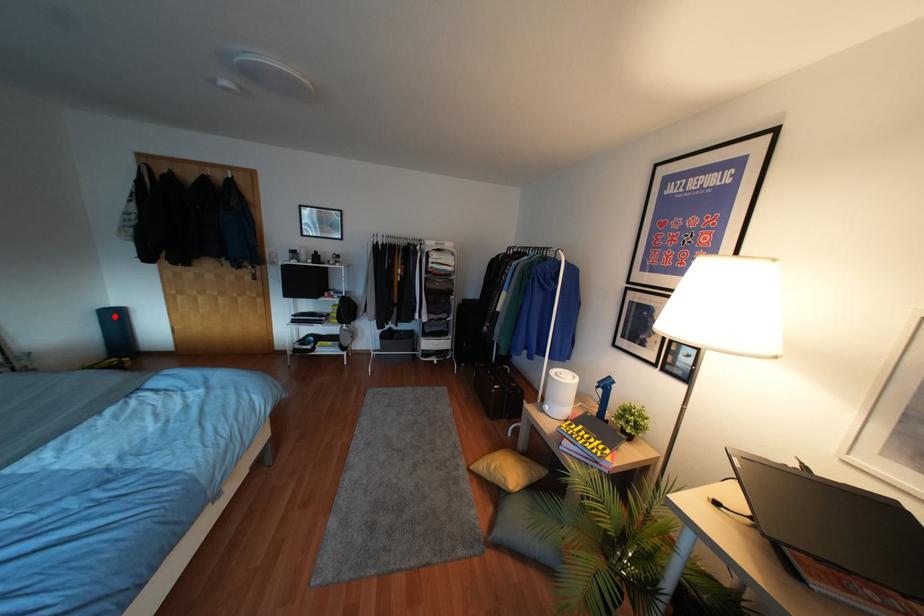
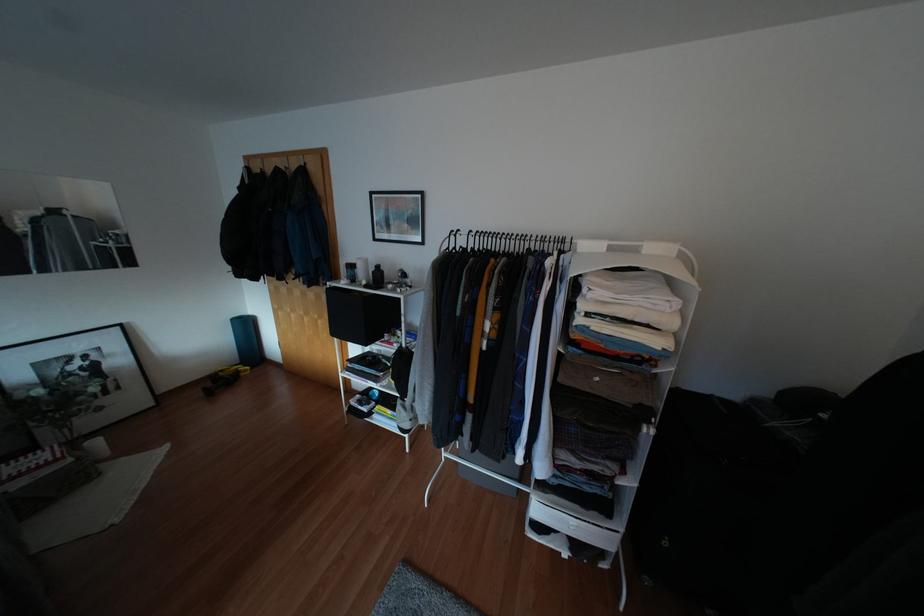
Question: I am providing you with two images of the same scene from different viewpoints. A red point is shown in image1. For the corresponding object point in image2, is it positioned nearer or farther from the camera?

Choices:
 (A) Nearer
 (B) Farther

Answer: (B)